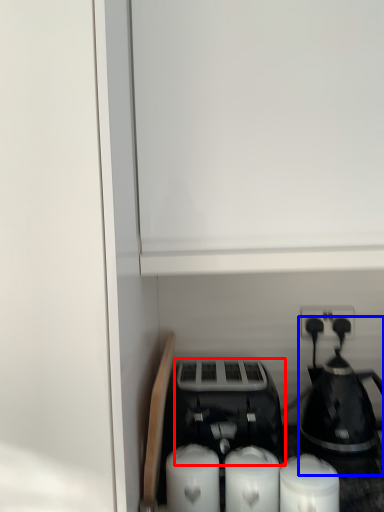
Question: Which object appears farthest to the camera in this image, toaster (highlighted by a red box) or coffee maker (highlighted by a blue box)?

Choices:
 (A) toaster
 (B) coffee maker

Answer: (B)